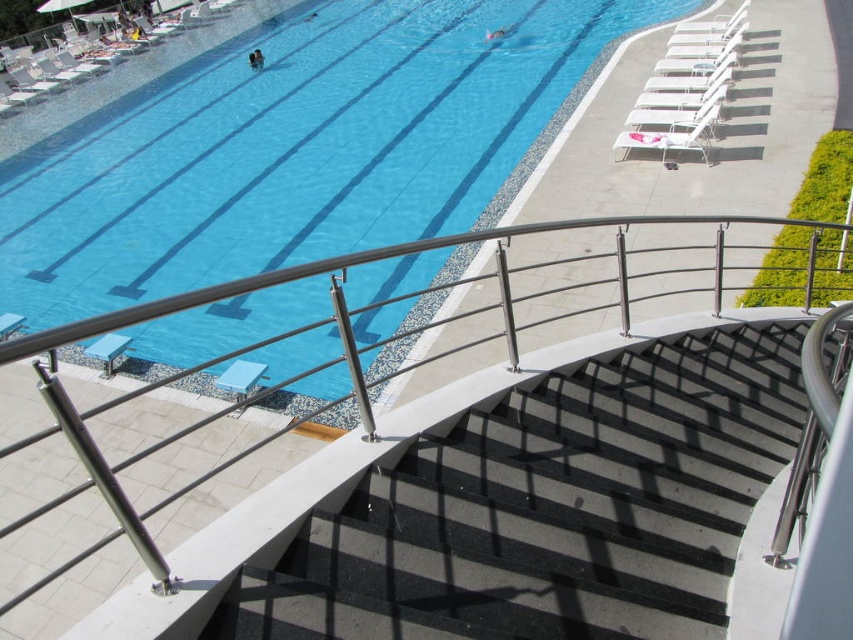
You are standing on the balcony and want to go down to the pool deck. The black textured stairs at center are your only path. Are the stairs positioned in the central area of the pool deck?

Yes, the black textured stairs at center are located at point coordinates indicating they are centrally positioned on the pool deck.

You are standing on the balcony and want to locate the blue glossy water at upper center. According to the coordinates provided, where exactly is the blue glossy water positioned in the image?

The blue glossy water at upper center is located at point coordinates of 0.236 on the x axis and 0.372 on the y axis.

You are standing at the top of the curved staircase with white steps and metallic handrails leading down to the pool area. You see two points marked on the pool deck. The first point is at coordinates point (310, 385) and the second point is at point (660, 596). If you want to walk from the staircase to the first point without passing in front of the second point, which direction should you take?

You should walk towards the first point at point (310, 385) while staying behind the second point at point (660, 596) since the first point is located behind the second point according to their coordinates.